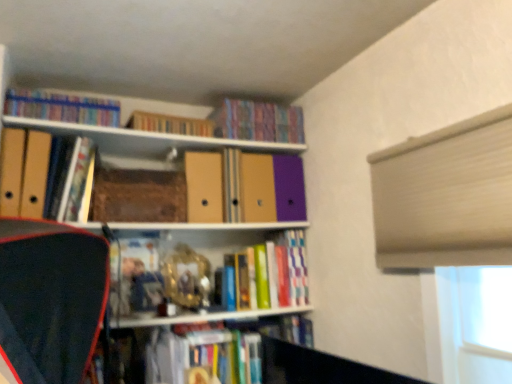
You are a GUI agent. You are given a task and a screenshot of the screen. Output one action in this format:
    pyautogui.click(x=<x>, y=<y>)
    Task: Click on the hardcover books at center, the second book positioned from the bottom
    The height and width of the screenshot is (384, 512).
    Given the screenshot: What is the action you would take?
    pyautogui.click(x=279, y=272)

Describe the element at coordinates (258, 121) in the screenshot. This screenshot has height=384, width=512. I see `matte purple book at upper center, placed as the 6th book when sorted from bottom to top` at that location.

Locate an element on the screen. hardcover book at center, which is counted as the seventh book, starting from the top is located at coordinates (165, 351).

Describe the element at coordinates (165, 351) in the screenshot. I see `hardcover book at center, positioned as the 1th book in bottom-to-top order` at that location.

Measure the distance between point (195, 172) and camera.

1.76 meters.

Where is `brown matte paper at center, which is the 1th paperback book from back to front`? brown matte paper at center, which is the 1th paperback book from back to front is located at coordinates pyautogui.click(x=138, y=196).

Image resolution: width=512 pixels, height=384 pixels. What do you see at coordinates (138, 196) in the screenshot?
I see `brown matte paper at center, which appears as the second paperback book when viewed from the left` at bounding box center [138, 196].

Locate an element on the screen. This screenshot has width=512, height=384. hardcover books at center, the second book positioned from the bottom is located at coordinates (279, 272).

Looking at this image, could you measure the distance between brown matte paper at center, which is the 1th paperback book from back to front, and hardcover book at upper left, positioned as the fourth book in top-to-bottom order?

brown matte paper at center, which is the 1th paperback book from back to front, is 5.93 inches away from hardcover book at upper left, positioned as the fourth book in top-to-bottom order.

Considering the sizes of brown matte paper at center, which appears as the second paperback book when viewed from the left, and hardcover book at upper left, which is the 4th book in bottom-to-top order, in the image, is brown matte paper at center, which appears as the second paperback book when viewed from the left, bigger or smaller than hardcover book at upper left, which is the 4th book in bottom-to-top order,?

brown matte paper at center, which appears as the second paperback book when viewed from the left, is bigger than hardcover book at upper left, which is the 4th book in bottom-to-top order.

From the picture: Is brown matte paper at center, which appears as the second paperback book when viewed from the left, outside of hardcover book at upper left, which is the 4th book in bottom-to-top order?

Yes.

Which of these two, brown matte paper at center, the 2th paperback book when ordered from front to back, or hardcover book at upper left, which is the 4th book in bottom-to-top order, stands taller?

hardcover book at upper left, which is the 4th book in bottom-to-top order, is taller.

How different are the orientations of matte purple book at upper center, placed as the 6th book when sorted from bottom to top, and hardcover books at upper left, which is counted as the first book, starting from the top, in degrees?

They differ by 4.74 degrees in their facing directions.

From a real-world perspective, who is located lower, matte purple book at upper center, which ranks as the second book in top-to-bottom order, or hardcover books at upper left, which is counted as the first book, starting from the top?

From a 3D spatial view, hardcover books at upper left, which is counted as the first book, starting from the top, is below.

From the image's perspective, which object appears higher, matte purple book at upper center, which ranks as the second book in top-to-bottom order, or hardcover books at upper left, which is the 7th book from bottom to top?

hardcover books at upper left, which is the 7th book from bottom to top, appears higher in the image.

Is matte purple book at upper center, which ranks as the second book in top-to-bottom order, aimed at hardcover book at upper center, the fifth book ordered from the bottom?

No, matte purple book at upper center, which ranks as the second book in top-to-bottom order, is not oriented towards hardcover book at upper center, the fifth book ordered from the bottom.

From the image's perspective, would you say matte purple book at upper center, placed as the 6th book when sorted from bottom to top, is positioned over hardcover book at upper center, the fifth book ordered from the bottom?

Yes, from the image's perspective, matte purple book at upper center, placed as the 6th book when sorted from bottom to top, is over hardcover book at upper center, the fifth book ordered from the bottom.

Is point (270, 113) closer to camera compared to point (149, 127)?

No, it is not.

Is hardcover books at upper left, which is counted as the first book, starting from the top, beside matte cardboard folder at center, marked as the 3th book in a bottom-to-top arrangement?

No, hardcover books at upper left, which is counted as the first book, starting from the top, is not making contact with matte cardboard folder at center, marked as the 3th book in a bottom-to-top arrangement.

Considering the relative positions of hardcover books at upper left, which is counted as the first book, starting from the top, and matte cardboard folder at center, marked as the 3th book in a bottom-to-top arrangement, in the image provided, is hardcover books at upper left, which is counted as the first book, starting from the top, in front of matte cardboard folder at center, marked as the 3th book in a bottom-to-top arrangement,?

Yes, hardcover books at upper left, which is counted as the first book, starting from the top, is closer to the camera.

In the scene shown: From the image's perspective, is hardcover books at upper left, which is counted as the first book, starting from the top, above or below matte cardboard folder at center, marked as the 3th book in a bottom-to-top arrangement?

hardcover books at upper left, which is counted as the first book, starting from the top, is situated higher than matte cardboard folder at center, marked as the 3th book in a bottom-to-top arrangement, in the image.

Which is more distant, (99, 116) or (209, 177)?

Positioned behind is point (209, 177).

From a real-world perspective, is matte cardboard folder at center, which is the 5th book in top-to-bottom order, above or below hardcover book at center, positioned as the 1th book in bottom-to-top order?

Clearly, from a real-world perspective, matte cardboard folder at center, which is the 5th book in top-to-bottom order, is above hardcover book at center, positioned as the 1th book in bottom-to-top order.

Between matte cardboard folder at center, marked as the 3th book in a bottom-to-top arrangement, and hardcover book at center, positioned as the 1th book in bottom-to-top order, which one has smaller size?

Smaller between the two is matte cardboard folder at center, marked as the 3th book in a bottom-to-top arrangement.

Which is more to the left, matte cardboard folder at center, marked as the 3th book in a bottom-to-top arrangement, or hardcover book at center, which is counted as the seventh book, starting from the top?

matte cardboard folder at center, marked as the 3th book in a bottom-to-top arrangement, is more to the left.

From the image's perspective, which one is positioned higher, matte cardboard folder at center, marked as the 3th book in a bottom-to-top arrangement, or hardcover book at center, which is counted as the seventh book, starting from the top?

matte cardboard folder at center, marked as the 3th book in a bottom-to-top arrangement, appears higher in the image.

The image size is (512, 384). In order to click on the 4th book positioned below the hardcover book at upper center, the 3th book when ordered from top to bottom (from the image's perspective) in this screenshot , I will do `click(165, 351)`.

From the image's perspective, which one is positioned lower, hardcover book at center, which is counted as the seventh book, starting from the top, or hardcover book at upper center, the 3th book when ordered from top to bottom?

From the image's view, hardcover book at center, which is counted as the seventh book, starting from the top, is below.

Is hardcover book at center, which is counted as the seventh book, starting from the top, aimed at hardcover book at upper center, the fifth book ordered from the bottom?

No, hardcover book at center, which is counted as the seventh book, starting from the top, is not oriented towards hardcover book at upper center, the fifth book ordered from the bottom.

From the image's perspective, does hardcover book at upper left, which is the 4th book in bottom-to-top order, appear higher than matte cardboard folder at center, marked as the 3th book in a bottom-to-top arrangement?

Correct, hardcover book at upper left, which is the 4th book in bottom-to-top order, appears higher than matte cardboard folder at center, marked as the 3th book in a bottom-to-top arrangement, in the image.

Does hardcover book at upper left, which is the 4th book in bottom-to-top order, touch matte cardboard folder at center, which is the 5th book in top-to-bottom order?

They are not placed beside each other.

Which object is closer to the camera, hardcover book at upper left, positioned as the fourth book in top-to-bottom order, or matte cardboard folder at center, marked as the 3th book in a bottom-to-top arrangement?

hardcover book at upper left, positioned as the fourth book in top-to-bottom order, is closer to the camera.

Between hardcover book at upper left, positioned as the fourth book in top-to-bottom order, and matte cardboard folder at center, marked as the 3th book in a bottom-to-top arrangement, which one has more height?

Standing taller between the two is matte cardboard folder at center, marked as the 3th book in a bottom-to-top arrangement.

From the image's perspective, starting from the brown matte paper at center, which is the 1th paperback book from back to front, which book is the 2nd one above? Please provide its 2D coordinates.

[(77, 180)]

Starting from the matte purple book at upper center, placed as the 6th book when sorted from bottom to top, which book is the 5th one to the left? Please provide its 2D coordinates.

[(62, 107)]

Considering their positions, is brown matte paper at center, which is counted as the 1th paperback book, starting from the right, positioned closer to hardcover books at upper left, which is counted as the first book, starting from the top, than matte purple book at upper center, which ranks as the second book in top-to-bottom order?

brown matte paper at center, which is counted as the 1th paperback book, starting from the right, lies closer to hardcover books at upper left, which is counted as the first book, starting from the top, than the other object.

From the image, which object appears to be farther from hardcover books at center, the second book positioned from the bottom, hardcover book at center, positioned as the 1th book in bottom-to-top order, or matte yellow folder at left, the 1th paperback book in the left-to-right sequence?

matte yellow folder at left, the 1th paperback book in the left-to-right sequence, is further to hardcover books at center, the second book positioned from the bottom.

Considering their positions, is brown matte paper at center, which is the 1th paperback book from back to front, positioned closer to hardcover books at upper left, which is counted as the first book, starting from the top, than matte yellow folder at left, the 1th paperback book in the left-to-right sequence?

matte yellow folder at left, the 1th paperback book in the left-to-right sequence, is positioned closer to the anchor hardcover books at upper left, which is counted as the first book, starting from the top.

In the scene shown: Based on their spatial positions, is matte purple book at upper center, which ranks as the second book in top-to-bottom order, or brown matte paper at center, which appears as the second paperback book when viewed from the left, closer to matte yellow folder at left, the second paperback book viewed from the back?

brown matte paper at center, which appears as the second paperback book when viewed from the left.

When comparing their distances from hardcover books at upper left, which is the 7th book from bottom to top, does matte purple book at upper center, which ranks as the second book in top-to-bottom order, or hardcover books at center, the second book positioned from the bottom, seem further?

hardcover books at center, the second book positioned from the bottom.

Based on their spatial positions, is hardcover book at center, positioned as the 1th book in bottom-to-top order, or hardcover books at upper left, which is the 7th book from bottom to top, further from hardcover book at upper center, the 3th book when ordered from top to bottom?

Among the two, hardcover book at center, positioned as the 1th book in bottom-to-top order, is located further to hardcover book at upper center, the 3th book when ordered from top to bottom.

Based on their spatial positions, is hardcover book at upper center, the 3th book when ordered from top to bottom, or hardcover books at upper left, which is the 7th book from bottom to top, further from hardcover books at center, the sixth book viewed from the top?

hardcover books at upper left, which is the 7th book from bottom to top, is positioned further to the anchor hardcover books at center, the sixth book viewed from the top.

Looking at the image, which one is located closer to hardcover book at center, positioned as the 1th book in bottom-to-top order, hardcover book at upper center, the fifth book ordered from the bottom, or matte purple book at upper center, placed as the 6th book when sorted from bottom to top?

hardcover book at upper center, the fifth book ordered from the bottom, is positioned closer to the anchor hardcover book at center, positioned as the 1th book in bottom-to-top order.

Where is `paperback book between matte yellow folder at left, acting as the 2th paperback book starting from the right, and hardcover book at center, which is counted as the seventh book, starting from the top, in the vertical direction`? paperback book between matte yellow folder at left, acting as the 2th paperback book starting from the right, and hardcover book at center, which is counted as the seventh book, starting from the top, in the vertical direction is located at coordinates click(x=138, y=196).

Locate an element on the screen. This screenshot has width=512, height=384. paperback book between hardcover books at upper left, which is counted as the first book, starting from the top, and hardcover books at center, the sixth book viewed from the top is located at coordinates (138, 196).

You are a GUI agent. You are given a task and a screenshot of the screen. Output one action in this format:
    pyautogui.click(x=<x>, y=<y>)
    Task: Click on the book between brown matte paper at center, which is the 1th paperback book from back to front, and matte cardboard folder at center, which is the 5th book in top-to-bottom order
    Image resolution: width=512 pixels, height=384 pixels.
    Given the screenshot: What is the action you would take?
    (170, 124)

Locate an element on the screen. This screenshot has width=512, height=384. book between matte cardboard folder at center, marked as the 3th book in a bottom-to-top arrangement, and hardcover book at center, which is counted as the seventh book, starting from the top, in the up-down direction is located at coordinates (279, 272).